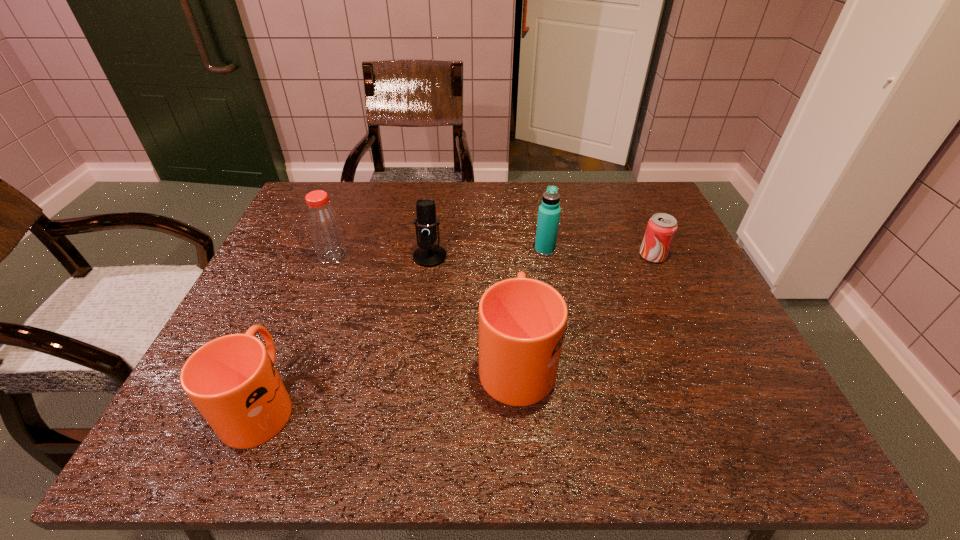
At what (x,y) coordinates should I click in order to perform the action: click on blank region between the left mug and the third object from left to right. Please return your answer as a coordinate pair (x, y). The image size is (960, 540). Looking at the image, I should click on (346, 329).

Image resolution: width=960 pixels, height=540 pixels. I want to click on vacant area that lies between the water bottle and the shorter mug, so click(x=403, y=326).

Find the location of `unoccupied position between the soda can and the left mug`. unoccupied position between the soda can and the left mug is located at coordinates (457, 329).

The image size is (960, 540). I want to click on vacant space that is in between the taller mug and the bottle, so click(x=424, y=307).

What are the coordinates of `vacant space in between the water bottle and the third object from left to right` in the screenshot? It's located at (488, 253).

Find the location of a particular element. The width and height of the screenshot is (960, 540). free space between the third object from left to right and the rightmost object is located at coordinates (541, 256).

I want to click on free space between the bottle and the left mug, so click(x=298, y=329).

I want to click on object that is the fifth closest one to the bottle, so click(x=661, y=228).

Locate which object is the fifth closest to the water bottle. Please provide its 2D coordinates. Your answer should be formatted as a tuple, i.e. [(x, y)], where the tuple contains the x and y coordinates of a point satisfying the conditions above.

[(232, 380)]

This screenshot has height=540, width=960. Find the location of `free point that satisfies the following two spatial constraints: 1. on the handle side of the water bottle; 2. on the right side of the right mug`. free point that satisfies the following two spatial constraints: 1. on the handle side of the water bottle; 2. on the right side of the right mug is located at coordinates (508, 250).